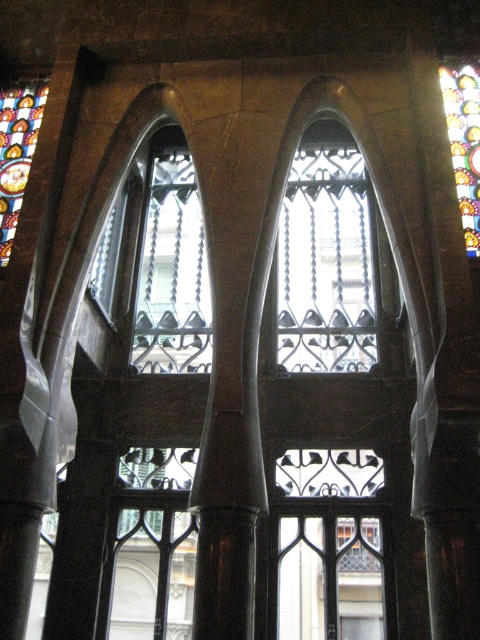
Question: Which of these objects is positioned farthest from the stained glass window at upper right?

Choices:
 (A) stained glass window at upper left
 (B) dark brown stone pillar at center
 (C) clear glass window at center

Answer: (A)

Question: Is the position of stained glass window at upper right less distant than that of stained glass window at upper left?

Choices:
 (A) no
 (B) yes

Answer: (B)

Question: Does dark brown stone pillar at center lie in front of stained glass window at upper left?

Choices:
 (A) no
 (B) yes

Answer: (B)

Question: Where is stained glass window at upper right located in relation to stained glass window at upper left in the image?

Choices:
 (A) left
 (B) right

Answer: (B)

Question: Which point is farther to the camera?

Choices:
 (A) stained glass window at upper left
 (B) clear glass window at center

Answer: (B)

Question: Which point appears closest to the camera in this image?

Choices:
 (A) (466, 193)
 (B) (20, 99)

Answer: (A)